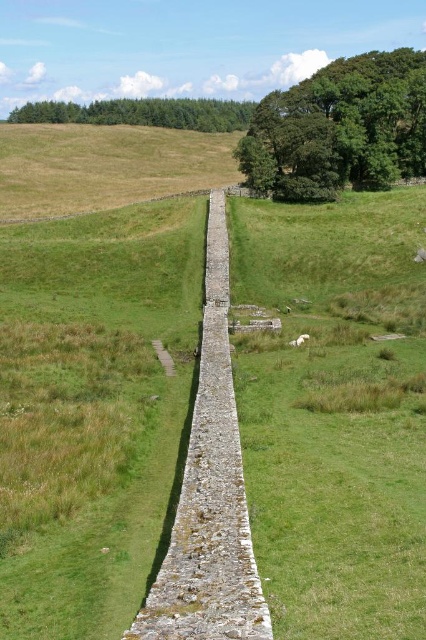
Question: Does gray stone wall at center appear on the right side of green textured trees at upper center?

Choices:
 (A) no
 (B) yes

Answer: (B)

Question: Which is farther from the green leafy tree at upper right?

Choices:
 (A) gray stone wall at center
 (B) green textured trees at upper center

Answer: (B)

Question: From the image, what is the correct spatial relationship of gray stone wall at center in relation to green textured trees at upper center?

Choices:
 (A) right
 (B) left

Answer: (A)

Question: Is gray stone wall at center smaller than green leafy tree at upper right?

Choices:
 (A) no
 (B) yes

Answer: (B)

Question: Which object is farther from the camera taking this photo?

Choices:
 (A) gray stone wall at center
 (B) green textured trees at upper center
 (C) green leafy tree at upper right

Answer: (B)

Question: Which object appears farthest from the camera in this image?

Choices:
 (A) green leafy tree at upper right
 (B) green textured trees at upper center

Answer: (B)